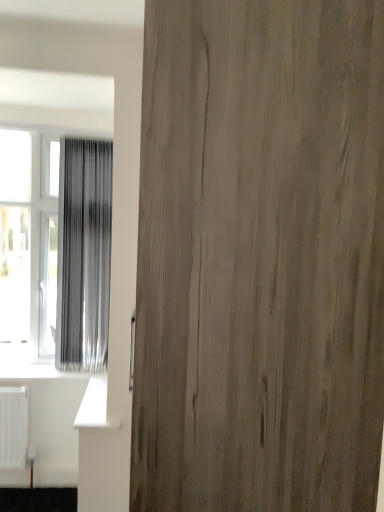
You are a GUI agent. You are given a task and a screenshot of the screen. Output one action in this format:
    pyautogui.click(x=<x>, y=<y>)
    Task: Click on the silvery metallic curtain at left
    The height and width of the screenshot is (512, 384).
    Given the screenshot: What is the action you would take?
    pyautogui.click(x=85, y=255)

Identify the location of wooden door at center. (260, 258).

Is transparent plastic window at left inside the boundaries of silvery metallic curtain at left, or outside?

transparent plastic window at left is not inside silvery metallic curtain at left, it's outside.

From a real-world perspective, is transparent plastic window at left above or below silvery metallic curtain at left?

transparent plastic window at left is situated lower than silvery metallic curtain at left in the real world.

Measure the distance from transparent plastic window at left to silvery metallic curtain at left.

transparent plastic window at left is 8.99 inches away from silvery metallic curtain at left.

Is silvery metallic curtain at left positioned behind wooden door at center?

Yes, silvery metallic curtain at left is further from the viewer.

Consider the image. Is silvery metallic curtain at left positioned far away from wooden door at center?

Yes.

From the image's perspective, is silvery metallic curtain at left located above or below wooden door at center?

Clearly, from the image's perspective, silvery metallic curtain at left is above wooden door at center.

Is wooden door at center at the back of silvery metallic curtain at left?

No, silvery metallic curtain at left's orientation is not away from wooden door at center.

How far apart are silvery metallic curtain at left and transparent plastic window at left?

A distance of 8.99 inches exists between silvery metallic curtain at left and transparent plastic window at left.

From the picture: Is silvery metallic curtain at left positioned with its back to transparent plastic window at left?

Absolutely, silvery metallic curtain at left is directed away from transparent plastic window at left.

Identify the location of window that is under the silvery metallic curtain at left (from a real-world perspective). This screenshot has width=384, height=512. (29, 238).

Between point (110, 200) and point (44, 233), which one is positioned in front?

The point (110, 200) is closer.

Can you confirm if transparent plastic window at left is positioned to the left of wooden door at center?

Yes.

Considering the sizes of objects transparent plastic window at left and wooden door at center in the image provided, who is smaller, transparent plastic window at left or wooden door at center?

transparent plastic window at left.

Between transparent plastic window at left and wooden door at center, which one has smaller width?

transparent plastic window at left is thinner.

Is transparent plastic window at left oriented away from wooden door at center?

transparent plastic window at left is not turned away from wooden door at center.

Looking at this image, from a real-world perspective, does wooden door at center sit lower than silvery metallic curtain at left?

Correct, in the physical world, wooden door at center is lower than silvery metallic curtain at left.

Based on the photo, which object is positioned more to the left, wooden door at center or silvery metallic curtain at left?

silvery metallic curtain at left.

Can you confirm if wooden door at center is smaller than silvery metallic curtain at left?

No.

Is wooden door at center wider or thinner than transparent plastic window at left?

wooden door at center is wider than transparent plastic window at left.

Which object is closer to the camera, wooden door at center or transparent plastic window at left?

wooden door at center is in front.

Where is `window beneath the wooden door at center (from a real-world perspective)`? Image resolution: width=384 pixels, height=512 pixels. window beneath the wooden door at center (from a real-world perspective) is located at coordinates (29, 238).

Considering the relative positions of wooden door at center and transparent plastic window at left in the image provided, is wooden door at center to the left of transparent plastic window at left from the viewer's perspective?

In fact, wooden door at center is to the right of transparent plastic window at left.

You are a GUI agent. You are given a task and a screenshot of the screen. Output one action in this format:
    pyautogui.click(x=<x>, y=<y>)
    Task: Click on the curtain that appears above the transparent plastic window at left (from the image's perspective)
    
    Given the screenshot: What is the action you would take?
    pyautogui.click(x=85, y=255)

Identify the location of door in front of the silvery metallic curtain at left. This screenshot has height=512, width=384. (260, 258).

Looking at the image, which one is located closer to silvery metallic curtain at left, transparent plastic window at left or wooden door at center?

Among the two, transparent plastic window at left is located nearer to silvery metallic curtain at left.

Estimate the real-world distances between objects in this image. Which object is closer to transparent plastic window at left, wooden door at center or silvery metallic curtain at left?

silvery metallic curtain at left is positioned closer to the anchor transparent plastic window at left.

From the image, which object appears to be nearer to wooden door at center, transparent plastic window at left or silvery metallic curtain at left?

Among the two, silvery metallic curtain at left is located nearer to wooden door at center.

When comparing their distances from silvery metallic curtain at left, does wooden door at center or transparent plastic window at left seem further?

wooden door at center is positioned further to the anchor silvery metallic curtain at left.

From the image, which object appears to be nearer to transparent plastic window at left, silvery metallic curtain at left or wooden door at center?

silvery metallic curtain at left lies closer to transparent plastic window at left than the other object.

Considering their positions, is silvery metallic curtain at left positioned closer to wooden door at center than transparent plastic window at left?

silvery metallic curtain at left is positioned closer to the anchor wooden door at center.

Where is `curtain between wooden door at center and transparent plastic window at left in the front-back direction`? curtain between wooden door at center and transparent plastic window at left in the front-back direction is located at coordinates (85, 255).